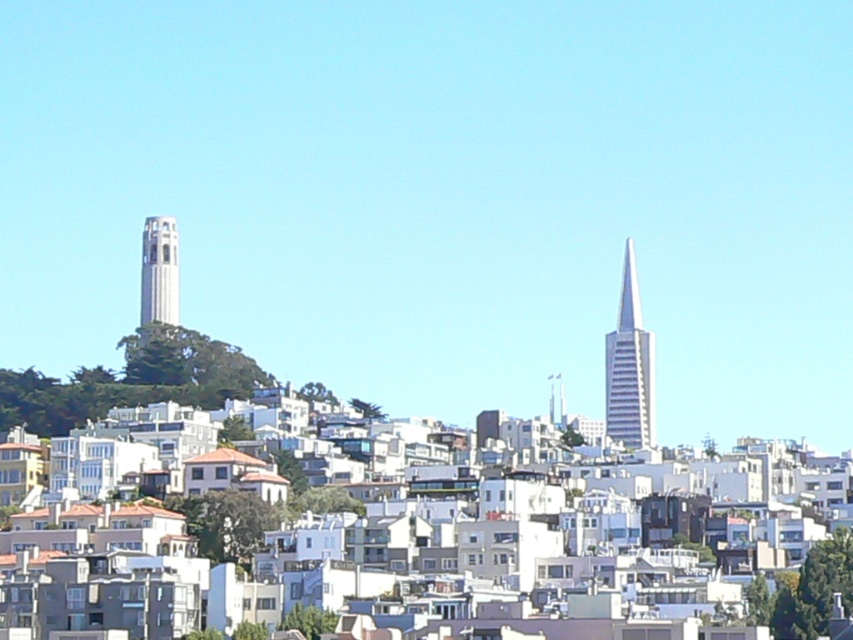
Question: Among these points, which one is nearest to the camera?

Choices:
 (A) (160, 220)
 (B) (645, 381)

Answer: (A)

Question: Is silver glass skyscraper at right further to the viewer compared to white stone tower at left?

Choices:
 (A) yes
 (B) no

Answer: (A)

Question: Where is silver glass skyscraper at right located in relation to white stone tower at left in the image?

Choices:
 (A) left
 (B) right

Answer: (B)

Question: Is silver glass skyscraper at right to the left of white stone tower at left from the viewer's perspective?

Choices:
 (A) no
 (B) yes

Answer: (A)

Question: Among these points, which one is farthest from the camera?

Choices:
 (A) (167, 232)
 (B) (612, 349)

Answer: (B)